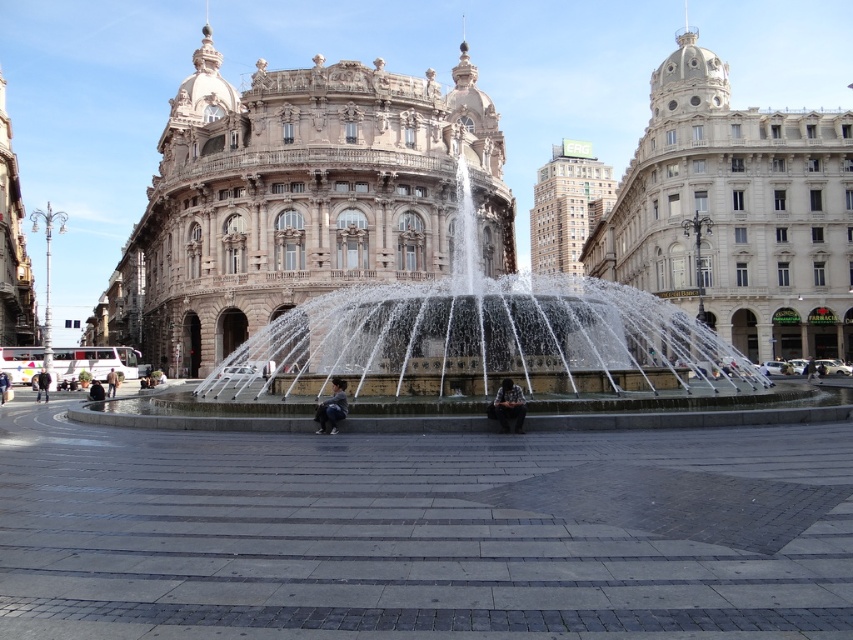
Question: Is polished stone fountain at center closer to the viewer compared to black fabric bag at center?

Choices:
 (A) no
 (B) yes

Answer: (B)

Question: Which of these objects is positioned closest to the white marble building at center?

Choices:
 (A) polished stone fountain at center
 (B) black leather jacket at lower left

Answer: (A)

Question: Can you confirm if black fabric bag at center is bigger than brown leather jacket at center?

Choices:
 (A) yes
 (B) no

Answer: (A)

Question: Which of the following is the closest to the observer?

Choices:
 (A) black fabric bag at center
 (B) marble stone palace at center

Answer: (A)

Question: Is white marble building at center to the left of black fabric bag at center from the viewer's perspective?

Choices:
 (A) yes
 (B) no

Answer: (B)

Question: Estimate the real-world distances between objects in this image. Which object is closer to the white marble building at center?

Choices:
 (A) black leather jacket at lower left
 (B) denim jacket at center

Answer: (B)